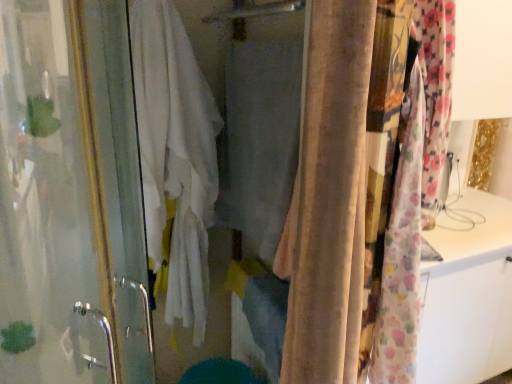
You are a GUI agent. You are given a task and a screenshot of the screen. Output one action in this format:
    pyautogui.click(x=<x>, y=<y>)
    Task: Click on the white cotton bath towel at center
    
    Given the screenshot: What is the action you would take?
    pyautogui.click(x=175, y=155)

Measure the distance between point (393, 206) and camera.

Point (393, 206) is 3.71 feet away from camera.

Find the location of `white cotton bath towel at center`. white cotton bath towel at center is located at coordinates (175, 155).

Who is taller, fluffy floral fabric at right, acting as the first curtain starting from the right, or transparent glass screen door at left?

With more height is transparent glass screen door at left.

From the picture: From the image's perspective, between fluffy floral fabric at right, acting as the first curtain starting from the right, and transparent glass screen door at left, who is located below?

From the image's view, transparent glass screen door at left is below.

Is fluffy floral fabric at right, acting as the first curtain starting from the right, turned away from transparent glass screen door at left?

No, fluffy floral fabric at right, acting as the first curtain starting from the right,'s orientation is not away from transparent glass screen door at left.

Does fluffy floral fabric at right, placed as the 2th curtain when sorted from left to right, touch transparent glass screen door at left?

fluffy floral fabric at right, placed as the 2th curtain when sorted from left to right, and transparent glass screen door at left are clearly separated.

Would you say fluffy floral fabric at right, placed as the 2th curtain when sorted from left to right, contains white cotton bath towel at center?

No, white cotton bath towel at center is located outside of fluffy floral fabric at right, placed as the 2th curtain when sorted from left to right.

From their relative heights in the image, would you say fluffy floral fabric at right, acting as the first curtain starting from the right, is taller or shorter than white cotton bath towel at center?

fluffy floral fabric at right, acting as the first curtain starting from the right, is shorter than white cotton bath towel at center.

Which is more to the right, fluffy floral fabric at right, acting as the first curtain starting from the right, or white cotton bath towel at center?

fluffy floral fabric at right, acting as the first curtain starting from the right.

Could you measure the distance between fluffy floral fabric at right, acting as the first curtain starting from the right, and white cotton bath towel at center?

A distance of 29.13 inches exists between fluffy floral fabric at right, acting as the first curtain starting from the right, and white cotton bath towel at center.

Can you confirm if beige velvet curtain at center, the 2th curtain from the right, is shorter than transparent glass screen door at left?

Yes, beige velvet curtain at center, the 2th curtain from the right, is shorter than transparent glass screen door at left.

Could you tell me if beige velvet curtain at center, the 2th curtain from the right, is turned towards transparent glass screen door at left?

Yes, beige velvet curtain at center, the 2th curtain from the right, is facing transparent glass screen door at left.

Who is bigger, beige velvet curtain at center, the 2th curtain from the right, or transparent glass screen door at left?

Bigger between the two is transparent glass screen door at left.

From a real-world perspective, which is physically above, beige velvet curtain at center, the 1th curtain when ordered from left to right, or transparent glass screen door at left?

beige velvet curtain at center, the 1th curtain when ordered from left to right, is physically above.

Is fluffy floral fabric at right, placed as the 2th curtain when sorted from left to right, wider or thinner than beige velvet curtain at center, the 2th curtain from the right?

fluffy floral fabric at right, placed as the 2th curtain when sorted from left to right, is wider than beige velvet curtain at center, the 2th curtain from the right.

From a real-world perspective, which is physically above, fluffy floral fabric at right, acting as the first curtain starting from the right, or beige velvet curtain at center, the 2th curtain from the right?

beige velvet curtain at center, the 2th curtain from the right, is physically above.

Is fluffy floral fabric at right, acting as the first curtain starting from the right, next to beige velvet curtain at center, the 2th curtain from the right?

Yes, fluffy floral fabric at right, acting as the first curtain starting from the right, is next to beige velvet curtain at center, the 2th curtain from the right.

Which is nearer, (447, 55) or (402, 145)?

The point (402, 145) is more forward.

From a real-world perspective, is transparent glass screen door at left beneath beige velvet curtain at center, the 2th curtain from the right?

Yes, from a real-world perspective, transparent glass screen door at left is under beige velvet curtain at center, the 2th curtain from the right.

Based on the photo, which of these two, transparent glass screen door at left or beige velvet curtain at center, the 2th curtain from the right, stands shorter?

With less height is beige velvet curtain at center, the 2th curtain from the right.

How many degrees apart are the facing directions of transparent glass screen door at left and beige velvet curtain at center, the 1th curtain when ordered from left to right?

There is a 90-degree angle between the facing directions of transparent glass screen door at left and beige velvet curtain at center, the 1th curtain when ordered from left to right.

Based on their positions, is transparent glass screen door at left located to the left or right of beige velvet curtain at center, the 2th curtain from the right?

Based on their positions, transparent glass screen door at left is located to the left of beige velvet curtain at center, the 2th curtain from the right.

Between transparent glass screen door at left and fluffy floral fabric at right, placed as the 2th curtain when sorted from left to right, which one has less height?

fluffy floral fabric at right, placed as the 2th curtain when sorted from left to right, is shorter.

Does transparent glass screen door at left contain fluffy floral fabric at right, acting as the first curtain starting from the right?

That's incorrect, fluffy floral fabric at right, acting as the first curtain starting from the right, is not inside transparent glass screen door at left.

Could you tell me if transparent glass screen door at left is facing fluffy floral fabric at right, acting as the first curtain starting from the right?

No, transparent glass screen door at left is not aimed at fluffy floral fabric at right, acting as the first curtain starting from the right.

Are transparent glass screen door at left and fluffy floral fabric at right, acting as the first curtain starting from the right, making contact?

transparent glass screen door at left and fluffy floral fabric at right, acting as the first curtain starting from the right, are not in contact.

What's the angular difference between beige velvet curtain at center, the 2th curtain from the right, and white cotton bath towel at center's facing directions?

91.5 degrees.

Is beige velvet curtain at center, the 2th curtain from the right, spatially inside white cotton bath towel at center, or outside of it?

beige velvet curtain at center, the 2th curtain from the right, is outside white cotton bath towel at center.

Between beige velvet curtain at center, the 1th curtain when ordered from left to right, and white cotton bath towel at center, which one has smaller width?

Thinner between the two is beige velvet curtain at center, the 1th curtain when ordered from left to right.

Considering the sizes of beige velvet curtain at center, the 2th curtain from the right, and white cotton bath towel at center in the image, is beige velvet curtain at center, the 2th curtain from the right, taller or shorter than white cotton bath towel at center?

beige velvet curtain at center, the 2th curtain from the right, is shorter than white cotton bath towel at center.

Locate an element on the screen. The width and height of the screenshot is (512, 384). the 2nd curtain behind when counting from the transparent glass screen door at left is located at coordinates (414, 191).

Where is `bath towel on the left of fluffy floral fabric at right, acting as the first curtain starting from the right`? Image resolution: width=512 pixels, height=384 pixels. bath towel on the left of fluffy floral fabric at right, acting as the first curtain starting from the right is located at coordinates (175, 155).

Based on their spatial positions, is white cotton bath towel at center or transparent glass screen door at left further from fluffy floral fabric at right, placed as the 2th curtain when sorted from left to right?

transparent glass screen door at left lies further to fluffy floral fabric at right, placed as the 2th curtain when sorted from left to right, than the other object.

From the image, which object appears to be farther from transparent glass screen door at left, beige velvet curtain at center, the 2th curtain from the right, or fluffy floral fabric at right, placed as the 2th curtain when sorted from left to right?

fluffy floral fabric at right, placed as the 2th curtain when sorted from left to right, lies further to transparent glass screen door at left than the other object.

Based on the photo, which object lies nearer to the anchor point transparent glass screen door at left, beige velvet curtain at center, the 1th curtain when ordered from left to right, or white cotton bath towel at center?

white cotton bath towel at center lies closer to transparent glass screen door at left than the other object.

Looking at the image, which one is located closer to fluffy floral fabric at right, acting as the first curtain starting from the right, beige velvet curtain at center, the 1th curtain when ordered from left to right, or white cotton bath towel at center?

beige velvet curtain at center, the 1th curtain when ordered from left to right, is positioned closer to the anchor fluffy floral fabric at right, acting as the first curtain starting from the right.

From the image, which object appears to be nearer to white cotton bath towel at center, fluffy floral fabric at right, acting as the first curtain starting from the right, or beige velvet curtain at center, the 2th curtain from the right?

The object closer to white cotton bath towel at center is beige velvet curtain at center, the 2th curtain from the right.

From the image, which object appears to be nearer to beige velvet curtain at center, the 1th curtain when ordered from left to right, fluffy floral fabric at right, acting as the first curtain starting from the right, or white cotton bath towel at center?

The object closer to beige velvet curtain at center, the 1th curtain when ordered from left to right, is fluffy floral fabric at right, acting as the first curtain starting from the right.

Based on their spatial positions, is transparent glass screen door at left or white cotton bath towel at center closer to fluffy floral fabric at right, placed as the 2th curtain when sorted from left to right?

white cotton bath towel at center is closer to fluffy floral fabric at right, placed as the 2th curtain when sorted from left to right.

Considering their positions, is white cotton bath towel at center positioned closer to fluffy floral fabric at right, acting as the first curtain starting from the right, than beige velvet curtain at center, the 2th curtain from the right?

Based on the image, beige velvet curtain at center, the 2th curtain from the right, appears to be nearer to fluffy floral fabric at right, acting as the first curtain starting from the right.

This screenshot has width=512, height=384. Find the location of `curtain between white cotton bath towel at center and fluffy floral fabric at right, placed as the 2th curtain when sorted from left to right, from left to right`. curtain between white cotton bath towel at center and fluffy floral fabric at right, placed as the 2th curtain when sorted from left to right, from left to right is located at coordinates (332, 197).

You are a GUI agent. You are given a task and a screenshot of the screen. Output one action in this format:
    pyautogui.click(x=<x>, y=<y>)
    Task: Click on the curtain between transparent glass screen door at left and fluffy floral fabric at right, placed as the 2th curtain when sorted from left to right
    The image size is (512, 384).
    Given the screenshot: What is the action you would take?
    pyautogui.click(x=332, y=197)

What are the coordinates of `bath towel between transparent glass screen door at left and fluffy floral fabric at right, placed as the 2th curtain when sorted from left to right, in the horizontal direction` in the screenshot? It's located at (175, 155).